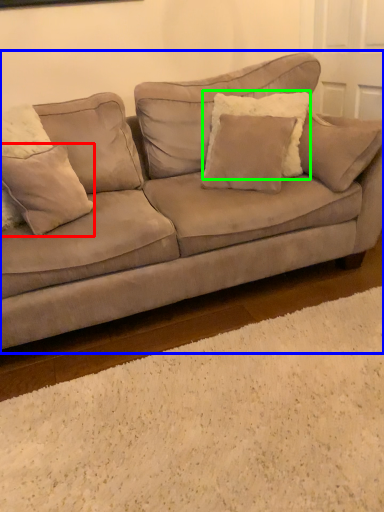
Question: Based on their relative distances, which object is nearer to pillow (highlighted by a red box)? Choose from studio couch (highlighted by a blue box) and pillow (highlighted by a green box).

Choices:
 (A) studio couch
 (B) pillow

Answer: (A)